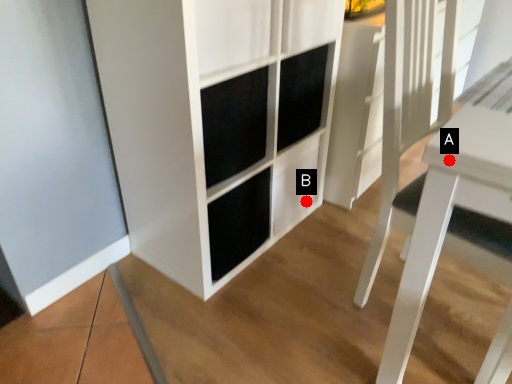
Question: Two points are circled on the image, labeled by A and B beside each circle. Which point is farther from the camera taking this photo?

Choices:
 (A) A is further
 (B) B is further

Answer: (B)